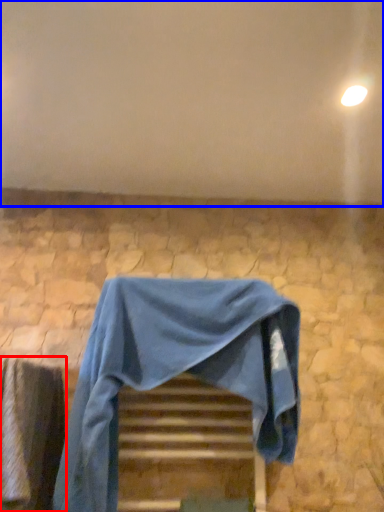
Question: Among these objects, which one is nearest to the camera, curtain (highlighted by a red box) or backdrop (highlighted by a blue box)?

Choices:
 (A) curtain
 (B) backdrop

Answer: (A)